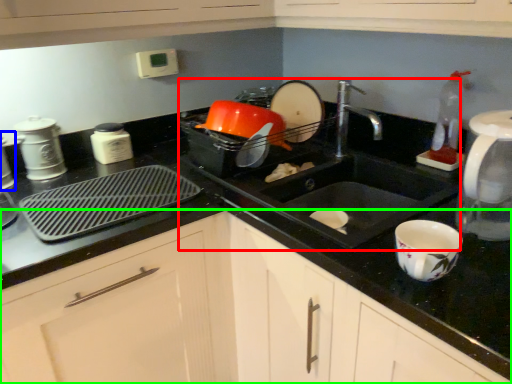
Question: Which object is the closest to the sink (highlighted by a red box)? Choose among these: appliance (highlighted by a blue box) or cabinetry (highlighted by a green box).

Choices:
 (A) appliance
 (B) cabinetry

Answer: (B)